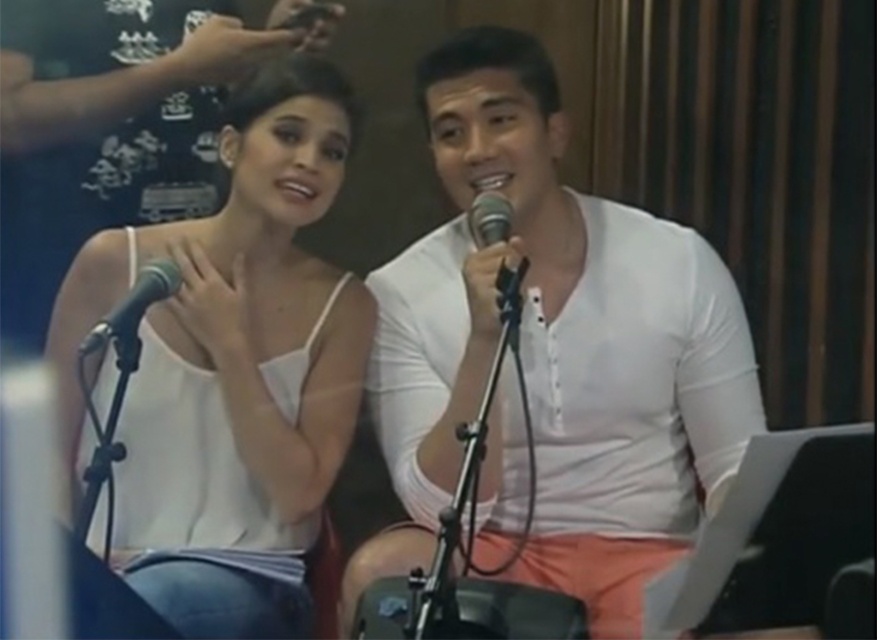
Can you confirm if black metallic microphone at left is wider than black metallic microphone at center?

Yes, black metallic microphone at left is wider than black metallic microphone at center.

Can you confirm if black metallic microphone at left is taller than black metallic microphone at center?

In fact, black metallic microphone at left may be shorter than black metallic microphone at center.

Locate an element on the screen. Image resolution: width=877 pixels, height=640 pixels. black metallic microphone at left is located at coordinates (134, 301).

Does white smooth shirt at center have a smaller size compared to black metallic microphone at center?

Incorrect, white smooth shirt at center is not smaller in size than black metallic microphone at center.

Between point (508, 180) and point (511, 307), which one is positioned in front?

Point (511, 307)

The width and height of the screenshot is (877, 640). What do you see at coordinates (555, 348) in the screenshot? I see `white smooth shirt at center` at bounding box center [555, 348].

Where is `white smooth shirt at center`? The image size is (877, 640). white smooth shirt at center is located at coordinates (555, 348).

Between white matte tank top at upper left and black metallic microphone at center, which one appears on the right side from the viewer's perspective?

Positioned to the right is black metallic microphone at center.

Between white matte tank top at upper left and black metallic microphone at center, which one is positioned lower?

white matte tank top at upper left is below.

Where is `white matte tank top at upper left`? The image size is (877, 640). white matte tank top at upper left is located at coordinates (232, 371).